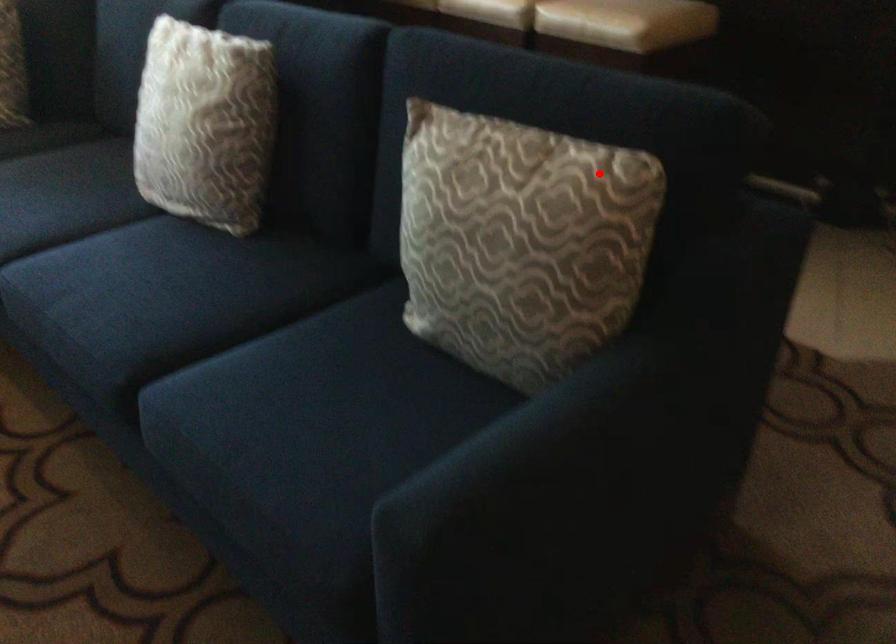
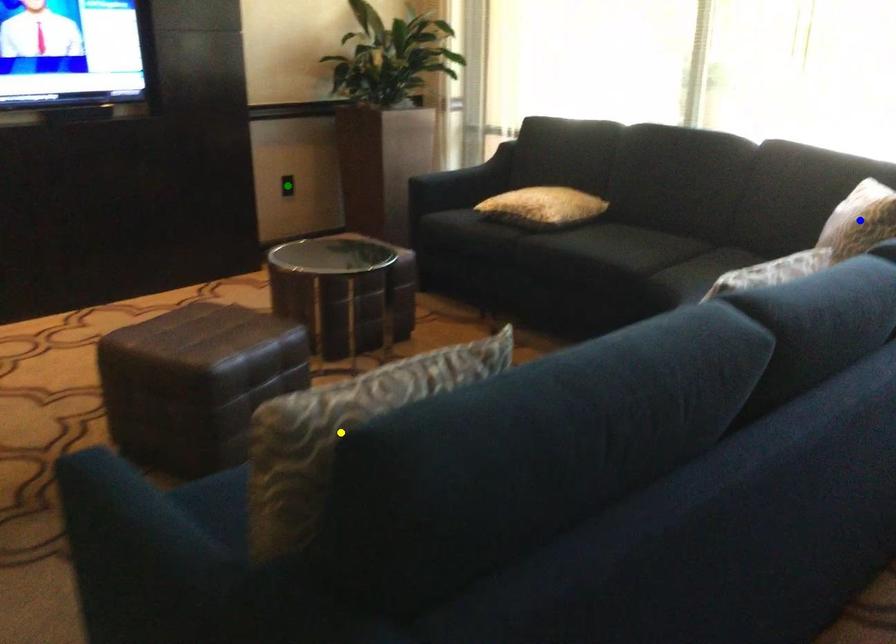
Question: I am providing you with two images of the same scene from different viewpoints. A red point is marked on the first image. You are given multiple points on the second image. In image 2, which mark is for the same physical point as the one in image 1?

Choices:
 (A) blue point
 (B) yellow point
 (C) green point

Answer: (B)